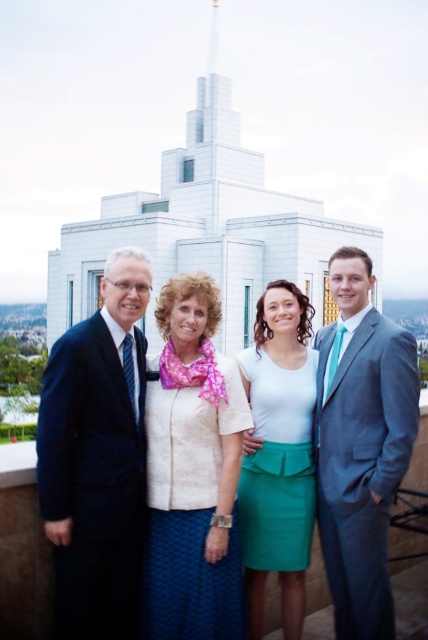
You are a photographer trying to capture a group photo of the two women in the scene. The women are wearing a white textured blouse at center and a white matte shirt at center. Since both are white, you want to ensure their tops are distinguishable in the photo. Which top has a longer length?

The white matte shirt at center is longer than the white textured blouse at center, so it will appear longer in the photo.

You are a photographer trying to capture a group photo of the people in front of the temple. You need to ensure that the dark blue suit at left and the white textured blouse at center are both visible in the frame. Based on their positions, which side of the temple should you position yourself to include both individuals?

You should position yourself to the right of the dark blue suit at left and the white textured blouse at center. Since the dark blue suit at left is to the left of the white textured blouse at center, positioning yourself to the right of both will ensure both are visible in the frame.